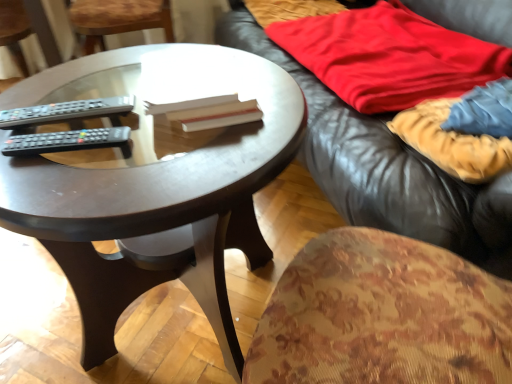
Where is `free location to the right of black plastic remote at center, marked as the 1th remote control in a back-to-front arrangement`? Image resolution: width=512 pixels, height=384 pixels. free location to the right of black plastic remote at center, marked as the 1th remote control in a back-to-front arrangement is located at coordinates (164, 136).